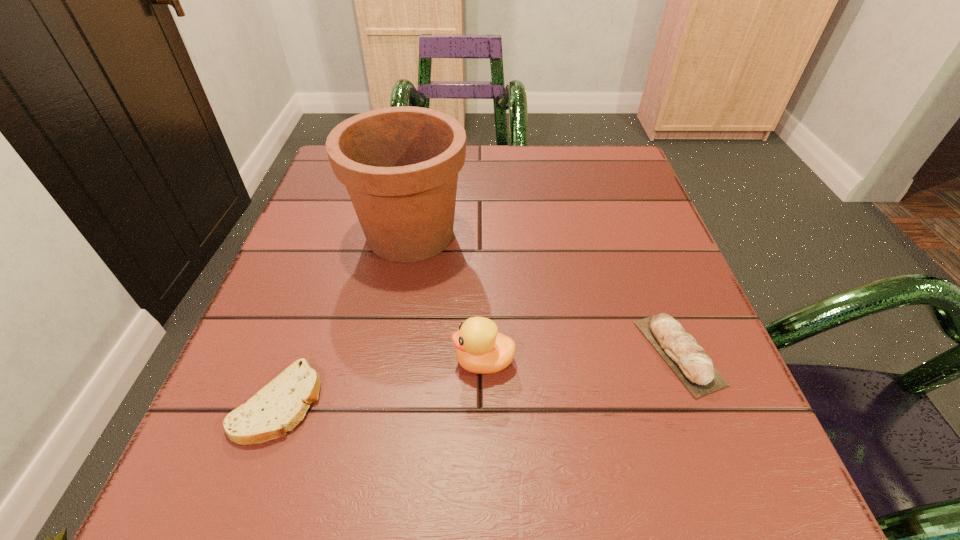
Locate an element on the screen. empty space that is in between the rightmost object and the flowerpot is located at coordinates (544, 293).

At what (x,y) coordinates should I click in order to perform the action: click on empty location between the shortest object and the second tallest object. Please return your answer as a coordinate pair (x, y). This screenshot has width=960, height=540. Looking at the image, I should click on (381, 382).

The image size is (960, 540). Find the location of `free space between the shortest object and the second tallest object`. free space between the shortest object and the second tallest object is located at coordinates (381, 382).

What are the coordinates of `vacant space that is in between the right pita bread and the shortest object` in the screenshot? It's located at (478, 377).

Identify the location of object that stands as the third closest to the flowerpot. (689, 361).

This screenshot has height=540, width=960. What are the coordinates of `object that is the third closest to the second shortest object` in the screenshot? It's located at (278, 407).

Find the location of a particular element. The image size is (960, 540). free point that satisfies the following two spatial constraints: 1. on the front side of the tallest object; 2. on the left side of the taller pita bread is located at coordinates (390, 352).

Locate an element on the screen. vacant space that satisfies the following two spatial constraints: 1. on the front side of the right pita bread; 2. on the face of the duckling is located at coordinates (682, 362).